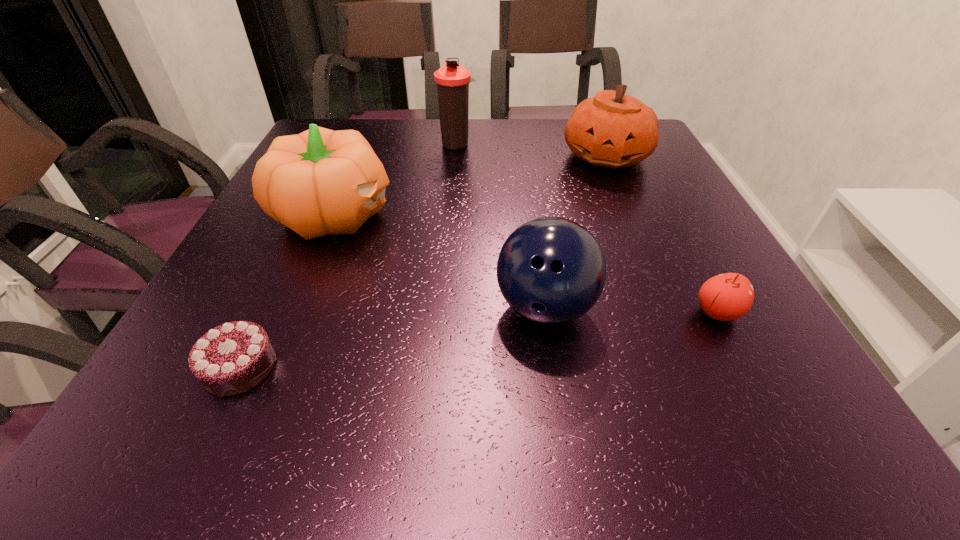
This screenshot has width=960, height=540. Identify the location of object located at the far right corner. (612, 129).

I want to click on free space at the far edge of the desktop, so click(436, 134).

Where is `vacant area at the near edge of the desktop`? The width and height of the screenshot is (960, 540). vacant area at the near edge of the desktop is located at coordinates (449, 409).

What are the coordinates of `vacant space at the left edge of the desktop` in the screenshot? It's located at (237, 259).

This screenshot has height=540, width=960. Find the location of `blank space at the right edge`. blank space at the right edge is located at coordinates (659, 244).

The width and height of the screenshot is (960, 540). I want to click on vacant point located between the bowling ball and the chocolate cake, so click(x=392, y=338).

The height and width of the screenshot is (540, 960). In order to click on free space between the chocolate cake and the bowling ball in this screenshot , I will do `click(392, 338)`.

The height and width of the screenshot is (540, 960). In order to click on free area in between the shortest object and the left pumpkin in this screenshot , I will do 287,291.

The height and width of the screenshot is (540, 960). Find the location of `free spot between the fourth object from right to left and the chocolate cake`. free spot between the fourth object from right to left and the chocolate cake is located at coordinates click(x=348, y=255).

This screenshot has height=540, width=960. I want to click on vacant space in between the fifth tallest object and the shortest object, so click(x=478, y=340).